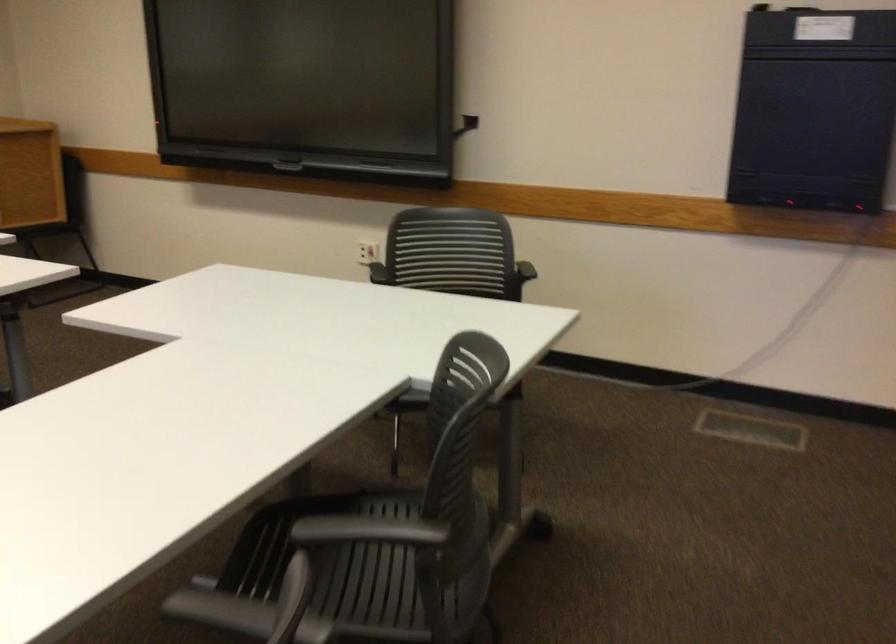
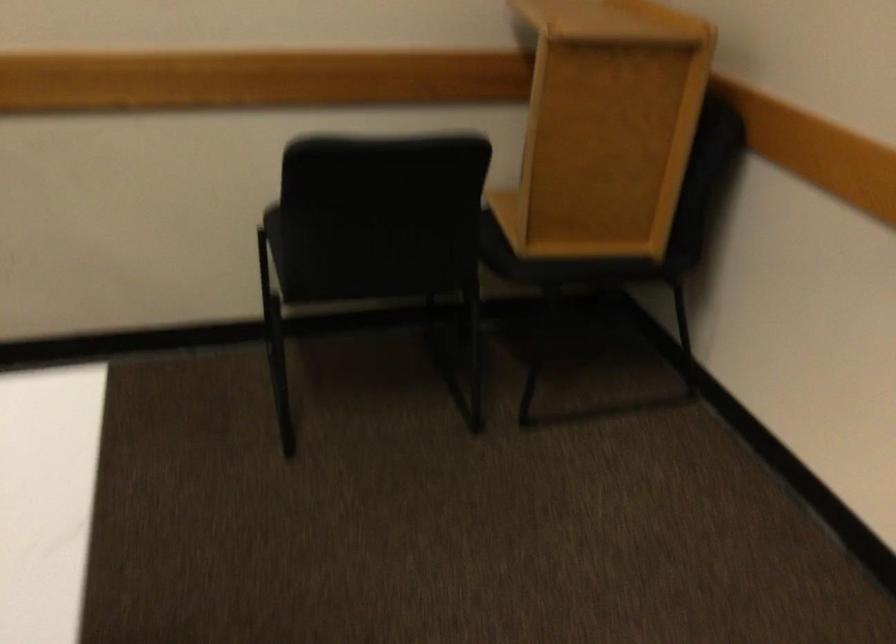
Where in the second image is the point corresponding to pixel 108 201 from the first image?

(586, 263)